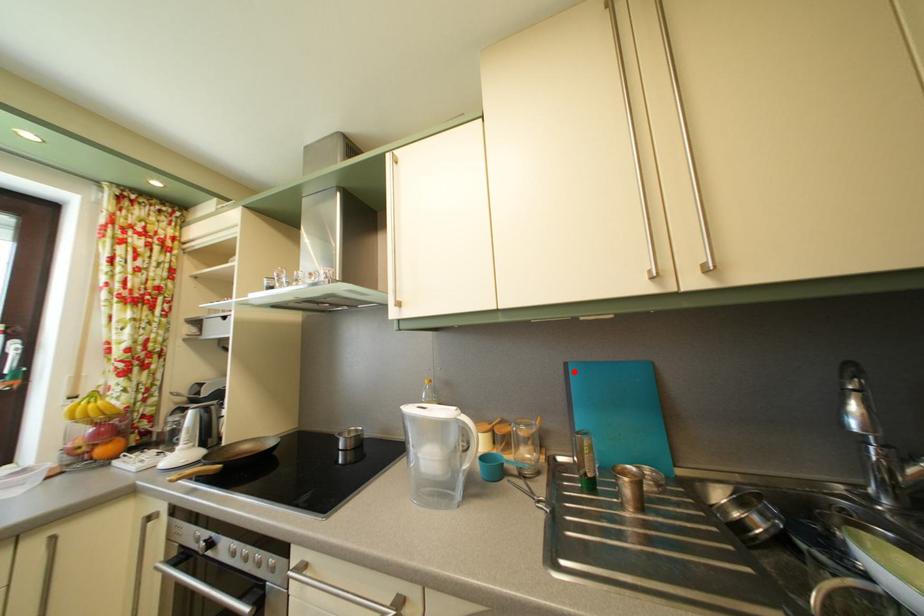
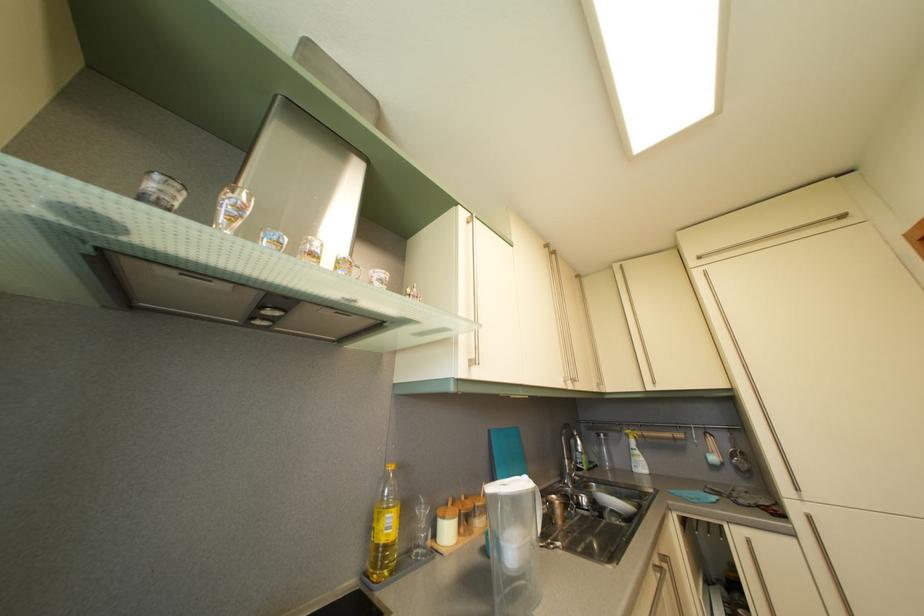
Locate, in the second image, the point that corresponds to the highlighted location in the first image.

(497, 439)